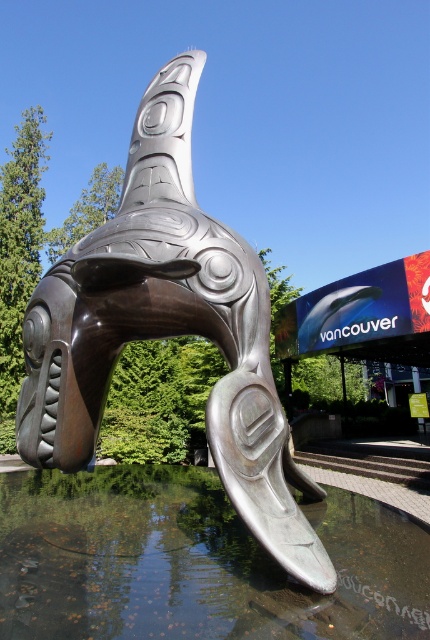
Based on the photo, you are standing in front of the metallic orca sculpture in the park. You notice two points marked on the sculpture at coordinates point (x=146, y=195) and point (x=282, y=618). If you want to touch the point closer to you, which coordinate should you reach for?

Point (x=146, y=195) is closer to you than point (x=282, y=618), so you should reach for point (x=146, y=195).

You are an artist planning to paint the scene. You need to ensure the proportions between the shiny bronze orca at center and the glossy reflective water at lower center are accurate. Which object should you make wider in your painting to maintain the correct proportions?

The glossy reflective water at lower center should be made wider in the painting since it has a greater width than the shiny bronze orca at center according to the description.